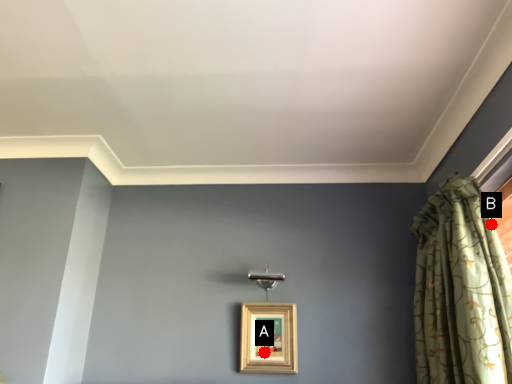
Question: Two points are circled on the image, labeled by A and B beside each circle. Which point is closer to the camera?

Choices:
 (A) A is closer
 (B) B is closer

Answer: (B)